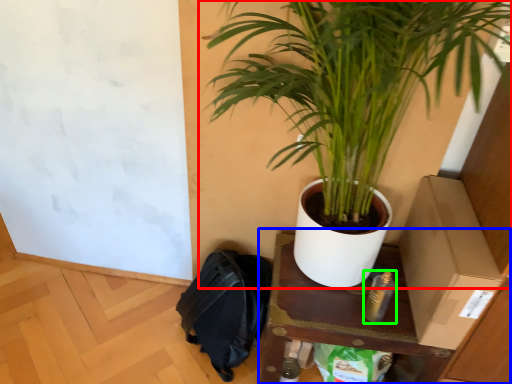
Question: Estimate the real-world distances between objects in this image. Which object is closer to houseplant (highlighted by a red box), table (highlighted by a blue box) or bottle (highlighted by a green box)?

Choices:
 (A) table
 (B) bottle

Answer: (A)